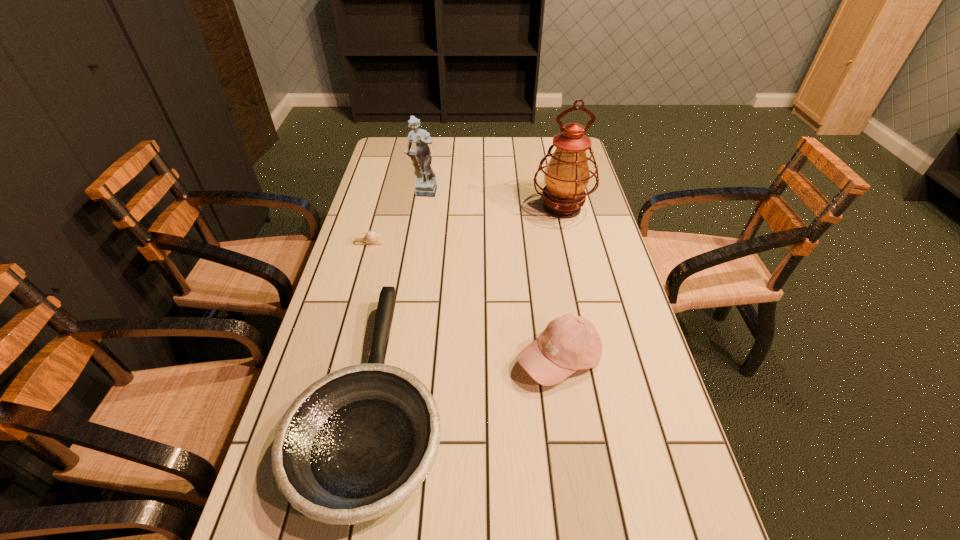
The height and width of the screenshot is (540, 960). I want to click on oil lamp, so click(567, 175).

Locate an element on the screen. The image size is (960, 540). the second tallest object is located at coordinates (426, 185).

The image size is (960, 540). What are the coordinates of `baseball cap` in the screenshot? It's located at (569, 343).

At what (x,y) coordinates should I click in order to perform the action: click on the fourth tallest object. Please return your answer as a coordinate pair (x, y). This screenshot has width=960, height=540. Looking at the image, I should click on (354, 445).

You are a GUI agent. You are given a task and a screenshot of the screen. Output one action in this format:
    pyautogui.click(x=<x>, y=<y>)
    Task: Click on the third nearest object
    Image resolution: width=960 pixels, height=540 pixels.
    Given the screenshot: What is the action you would take?
    pyautogui.click(x=371, y=237)

This screenshot has height=540, width=960. In order to click on the shortest object in this screenshot , I will do `click(371, 237)`.

Locate an element on the screen. vacant region located on the front of the oil lamp is located at coordinates (576, 268).

Locate an element on the screen. vacant space situated on the front-facing side of the second tallest object is located at coordinates (416, 231).

The image size is (960, 540). Identify the location of free space located on the front-facing side of the baseball cap. (571, 435).

What are the coordinates of `free region located 0.290m on the handle side of the second shortest object` in the screenshot? It's located at (406, 236).